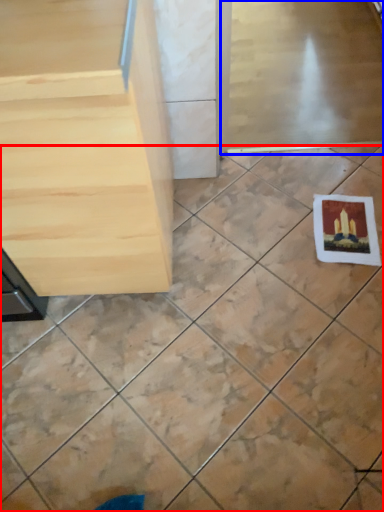
Question: Among these objects, which one is nearest to the camera, ceramic tile (highlighted by a red box) or screen door (highlighted by a blue box)?

Choices:
 (A) ceramic tile
 (B) screen door

Answer: (A)